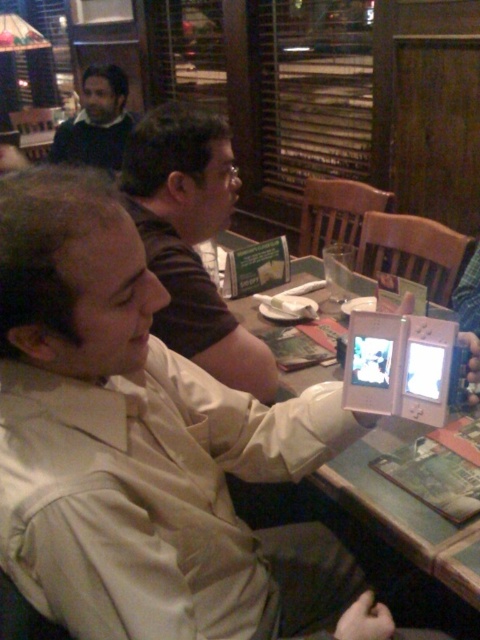
Between matte black shirt at upper center and dark blue sweater at upper left, which one is positioned higher?

dark blue sweater at upper left is above.

Is matte black shirt at upper center to the right of dark blue sweater at upper left from the viewer's perspective?

Correct, you'll find matte black shirt at upper center to the right of dark blue sweater at upper left.

What do you see at coordinates (191, 240) in the screenshot? Image resolution: width=480 pixels, height=640 pixels. I see `matte black shirt at upper center` at bounding box center [191, 240].

Locate an element on the screen. matte black shirt at upper center is located at coordinates (191, 240).

Which is above, matte black shirt at upper center or silver metallic tablet at center?

matte black shirt at upper center is above.

Between point (142, 234) and point (384, 323), which one is positioned behind?

Positioned behind is point (142, 234).

Does point (144, 141) come in front of point (384, 394)?

No, it is behind (384, 394).

Identify the location of matte black shirt at upper center. (191, 240).

Does beige fabric shirt at center appear on the left side of dark blue sweater at upper left?

In fact, beige fabric shirt at center is to the right of dark blue sweater at upper left.

Which is behind, point (68, 168) or point (80, 125)?

Point (68, 168)

Is point (153, 586) positioned in front of point (90, 152)?

That is True.

Image resolution: width=480 pixels, height=640 pixels. Find the location of `beige fabric shirt at center`. beige fabric shirt at center is located at coordinates (145, 449).